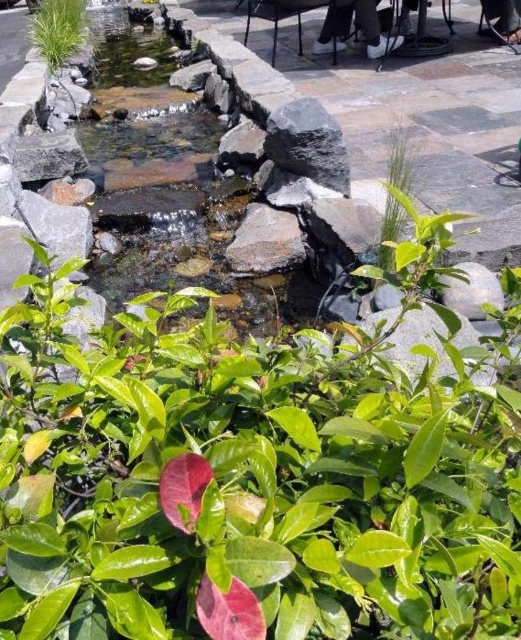
Does smooth gray rock at center appear on the left side of white leather shoes at upper center?

Indeed, smooth gray rock at center is positioned on the left side of white leather shoes at upper center.

Does smooth gray rock at center appear on the right side of white leather shoes at upper center?

In fact, smooth gray rock at center is to the left of white leather shoes at upper center.

Who is more forward, (286, 248) or (378, 54)?

Point (286, 248) is in front.

Find the location of `smooth gray rock at center`. smooth gray rock at center is located at coordinates (266, 241).